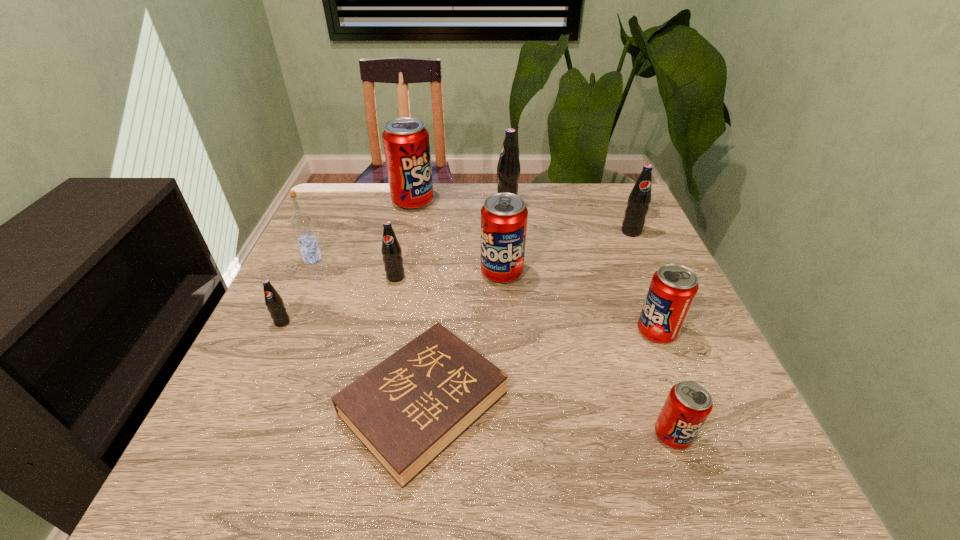
In the image, there is a desktop. What are the coordinates of `blank space at the far left corner` in the screenshot? It's located at (344, 224).

Find the location of a particular element. The height and width of the screenshot is (540, 960). free space at the near right corner of the desktop is located at coordinates (736, 460).

The image size is (960, 540). In order to click on free space between the blue vodka and the nearest red soda can in this screenshot , I will do (x=492, y=347).

Locate an element on the screen. The image size is (960, 540). free space between the third farthest soda can and the hardback book is located at coordinates (527, 318).

Identify the location of free spot between the third biggest red soda can and the second red soda can from left to right. Image resolution: width=960 pixels, height=540 pixels. (579, 302).

Where is `free point between the second farthest red soda can and the third black pop from right to left`? Image resolution: width=960 pixels, height=540 pixels. free point between the second farthest red soda can and the third black pop from right to left is located at coordinates (448, 275).

I want to click on vacant space that's between the second red soda can from left to right and the nearest soda can, so click(588, 354).

Where is `vacant space in between the vodka and the hardback book`? This screenshot has height=540, width=960. vacant space in between the vodka and the hardback book is located at coordinates (369, 332).

Where is `free point between the third farthest red soda can and the hardback book`? free point between the third farthest red soda can and the hardback book is located at coordinates (540, 368).

Locate an element on the screen. Image resolution: width=960 pixels, height=540 pixels. empty space that is in between the third nearest red soda can and the brown hardback book is located at coordinates (463, 338).